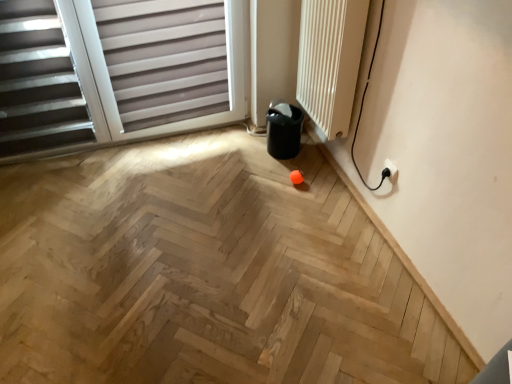
What are the coordinates of `vacant area situated below matte gray blinds at upper left (from a real-world perspective)` in the screenshot? It's located at (128, 143).